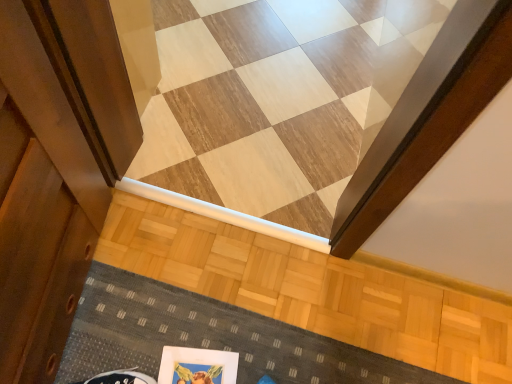
Question: Is wooden floor at center completely or partially outside of textured gray doormat at lower center?

Choices:
 (A) yes
 (B) no

Answer: (A)

Question: Is wooden floor at center oriented towards textured gray doormat at lower center?

Choices:
 (A) no
 (B) yes

Answer: (B)

Question: Is textured gray doormat at lower center a part of wooden floor at center?

Choices:
 (A) yes
 (B) no

Answer: (B)

Question: Does wooden floor at center have a smaller size compared to textured gray doormat at lower center?

Choices:
 (A) no
 (B) yes

Answer: (A)

Question: Considering the relative sizes of wooden floor at center and textured gray doormat at lower center in the image provided, is wooden floor at center shorter than textured gray doormat at lower center?

Choices:
 (A) no
 (B) yes

Answer: (B)

Question: In terms of height, does matte white picture frame at lower center look taller or shorter compared to wooden floor at center?

Choices:
 (A) short
 (B) tall

Answer: (A)

Question: Based on their positions, is matte white picture frame at lower center located to the left or right of wooden floor at center?

Choices:
 (A) left
 (B) right

Answer: (A)

Question: Considering the positions of matte white picture frame at lower center and wooden floor at center in the image, is matte white picture frame at lower center wider or thinner than wooden floor at center?

Choices:
 (A) wide
 (B) thin

Answer: (B)

Question: Considering their positions, is matte white picture frame at lower center located in front of or behind wooden floor at center?

Choices:
 (A) behind
 (B) front

Answer: (B)

Question: Considering their positions, is textured gray doormat at lower center located in front of or behind matte white picture frame at lower center?

Choices:
 (A) front
 (B) behind

Answer: (B)

Question: Do you think textured gray doormat at lower center is within matte white picture frame at lower center, or outside of it?

Choices:
 (A) inside
 (B) outside

Answer: (B)

Question: Looking at their shapes, would you say textured gray doormat at lower center is wider or thinner than matte white picture frame at lower center?

Choices:
 (A) thin
 (B) wide

Answer: (A)

Question: In the image, is textured gray doormat at lower center on the left side or the right side of matte white picture frame at lower center?

Choices:
 (A) left
 (B) right

Answer: (B)

Question: Looking at their shapes, would you say textured gray doormat at lower center is wider or thinner than wooden floor at center?

Choices:
 (A) thin
 (B) wide

Answer: (A)

Question: Based on their positions, is textured gray doormat at lower center located to the left or right of wooden floor at center?

Choices:
 (A) left
 (B) right

Answer: (B)